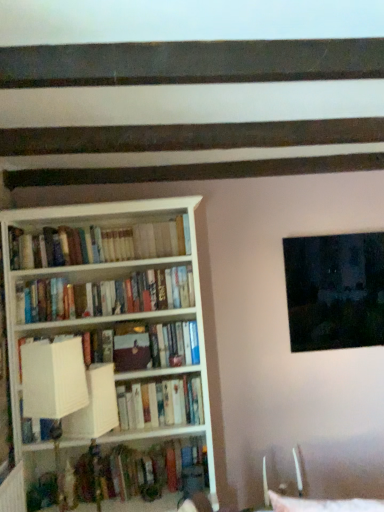
Question: In terms of height, does white fabric lampshade at left look taller or shorter compared to hardcover books at center, which ranks as the third book in bottom-to-top order?

Choices:
 (A) tall
 (B) short

Answer: (A)

Question: Is point (52, 391) positioned closer to the camera than point (49, 300)?

Choices:
 (A) closer
 (B) farther

Answer: (A)

Question: Estimate the real-world distances between objects in this image. Which object is closer to the dark matte painting at upper right?

Choices:
 (A) metallic silver swivel chair at lower right
 (B) white matte bookshelf at upper left, which is the first book in top-to-bottom order
 (C) hardcover books at center, the second book from the top
 (D) white wood bookcase at left
 (E) wooden book at lower center, which appears as the first book when ordered from the bottom

Answer: (A)

Question: Estimate the real-world distances between objects in this image. Which object is farther from the matte brown book at center?

Choices:
 (A) white matte bookshelf at upper left, which is the first book in top-to-bottom order
 (B) hardcover books at center, the second book from the top
 (C) white wood bookcase at left
 (D) wooden book at lower center, which appears as the first book when ordered from the bottom
 (E) white fabric lampshade at left

Answer: (E)